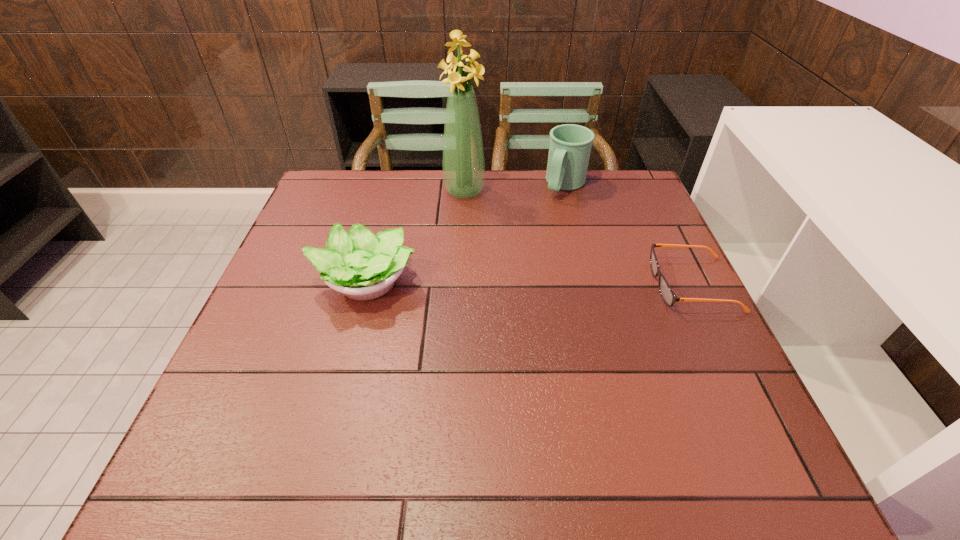
At what (x,y) coordinates should I click in order to perform the action: click on vacant space on the desktop that is between the third tallest object and the spectacles and is positioned on the side of the second tallest object with the handle. Please return your answer as a coordinate pair (x, y). The width and height of the screenshot is (960, 540). Looking at the image, I should click on coord(496,283).

Identify the location of free space on the desktop that is between the lettuce and the rightmost object and is positioned on the front-facing side of the third object from right to left. (512, 283).